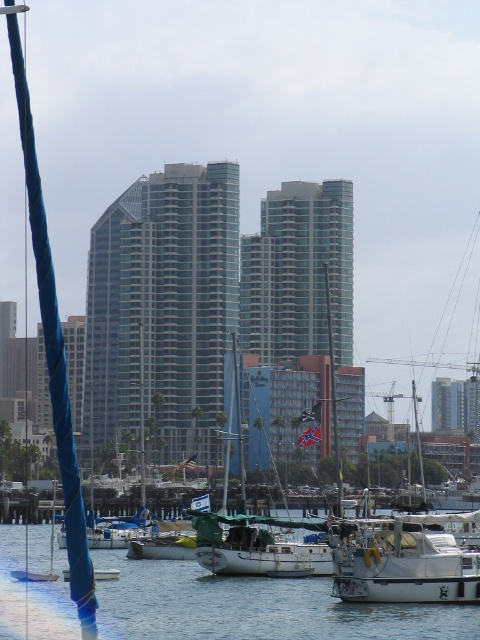
Does clear water at lower center have a lesser width compared to white matte sailboat at center?

In fact, clear water at lower center might be wider than white matte sailboat at center.

I want to click on clear water at lower center, so click(253, 605).

The height and width of the screenshot is (640, 480). Identify the location of clear water at lower center. (253, 605).

Who is taller, clear water at lower center or white matte boat at center?

clear water at lower center

Measure the distance between clear water at lower center and white matte boat at center.

The distance of clear water at lower center from white matte boat at center is 20.26 meters.

Who is more forward, [219,621] or [440,598]?

Point [440,598] is in front.

Where is `clear water at lower center`? clear water at lower center is located at coordinates (253, 605).

Who is positioned more to the right, white matte boat at center or white matte sailboat at center?

white matte boat at center

Is white matte boat at center above white matte sailboat at center?

Indeed, white matte boat at center is positioned over white matte sailboat at center.

What do you see at coordinates (407, 561) in the screenshot? I see `white matte boat at center` at bounding box center [407, 561].

Locate an element on the screen. The image size is (480, 640). white matte boat at center is located at coordinates (407, 561).